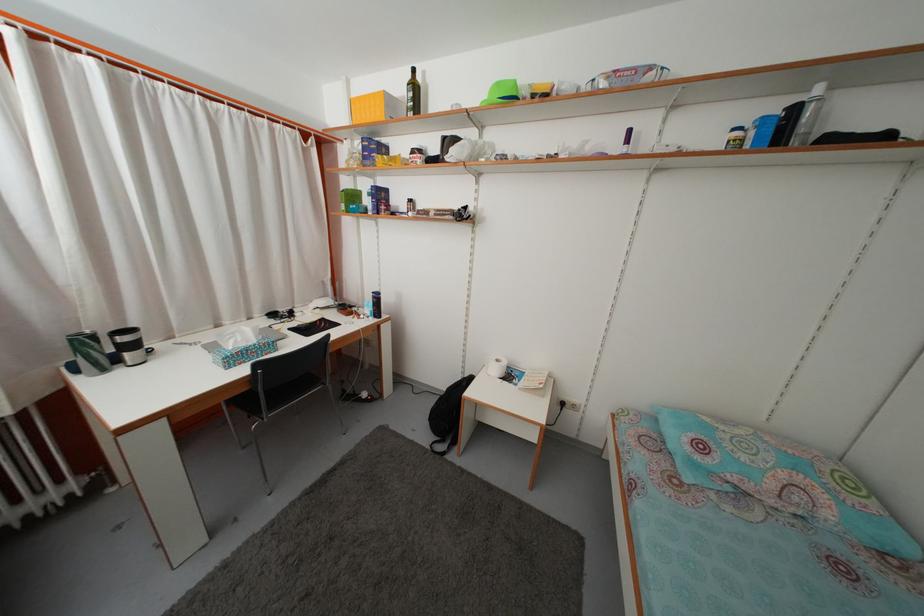
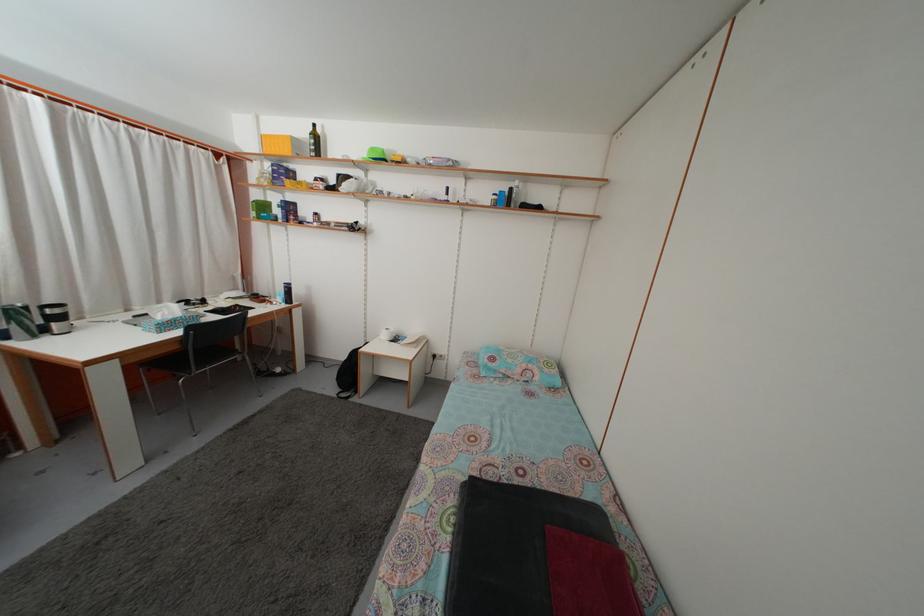
Question: What movement of the cameraman would produce the second image?

Choices:
 (A) Left
 (B) Right
 (C) Forward
 (D) Backward

Answer: (D)